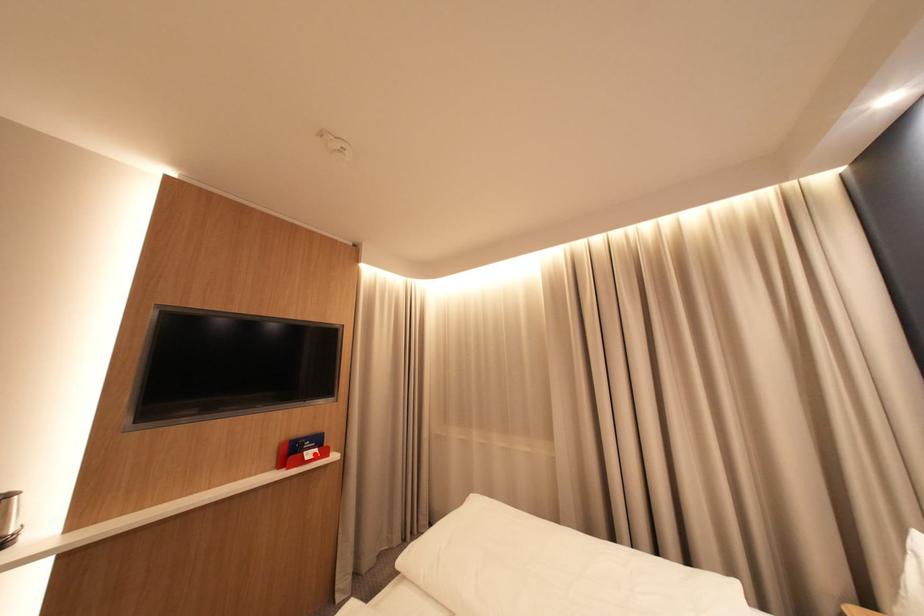
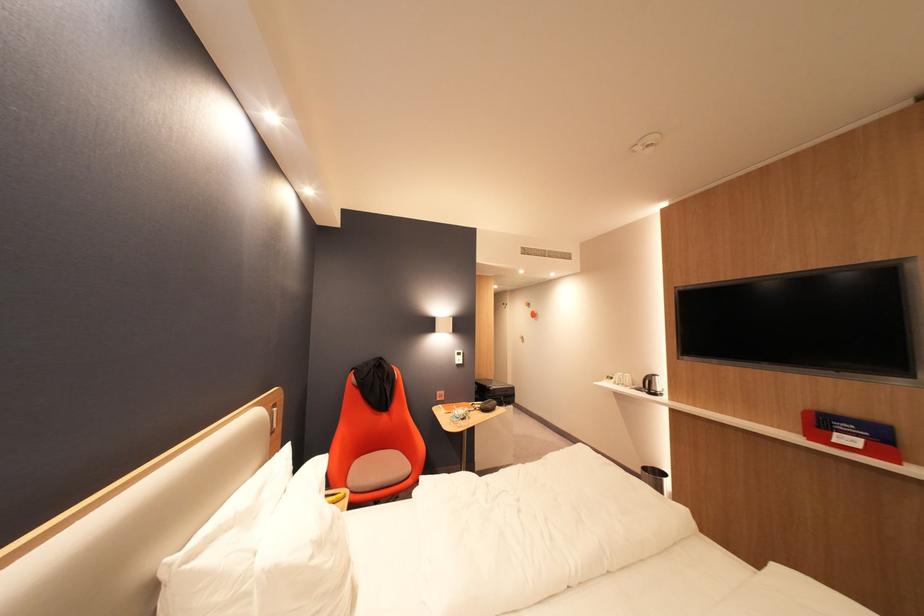
Locate, in the second image, the point that corresponds to the highlighted location in the first image.

(846, 435)